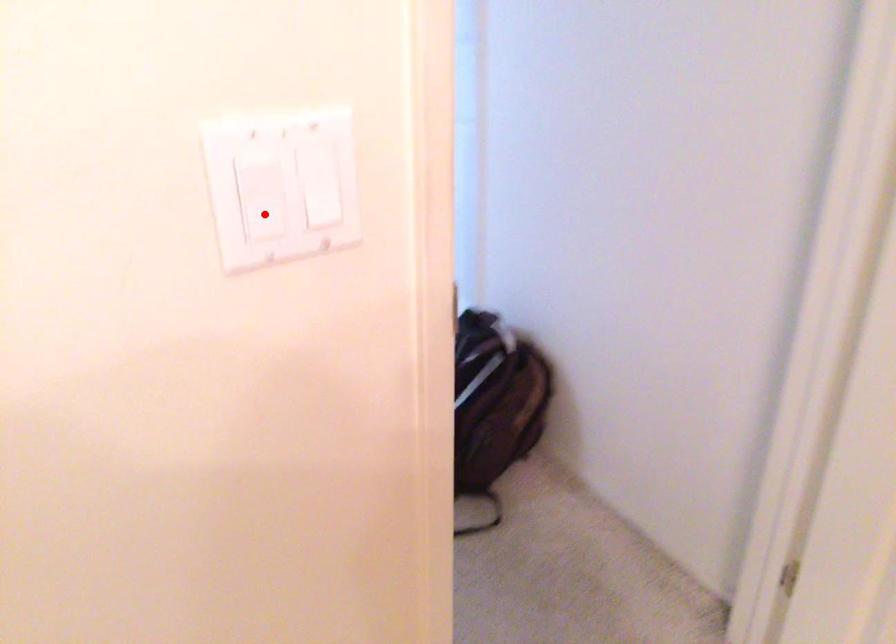
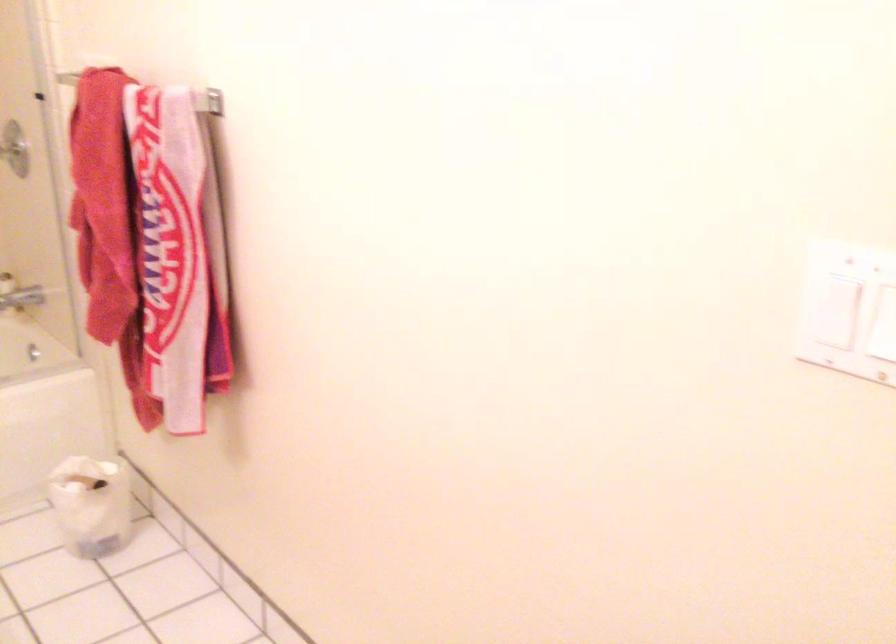
Find the pixel in the second image that matches the highlighted location in the first image.

(831, 295)